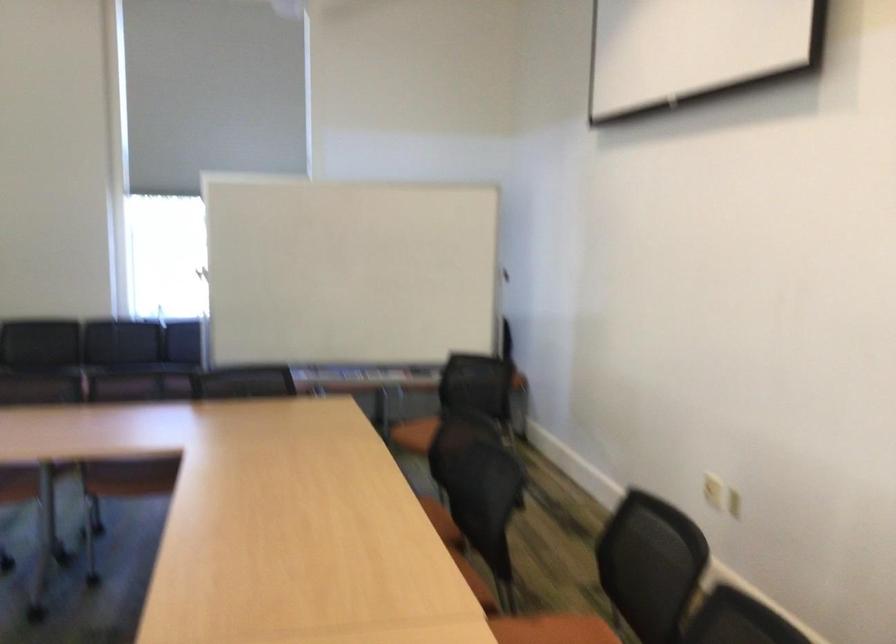
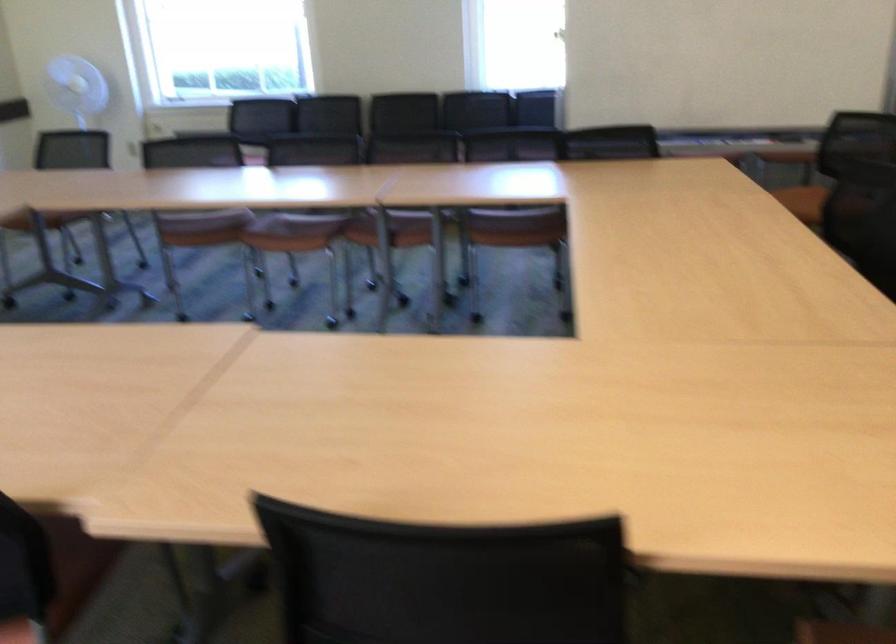
Question: The images are taken continuously from a first-person perspective. In which direction are you moving?

Choices:
 (A) Left
 (B) Right
 (C) Forward
 (D) Backward

Answer: (A)